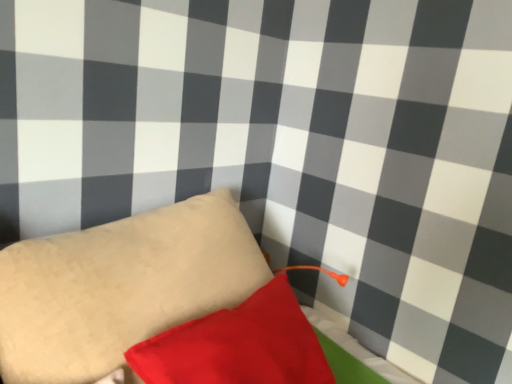
In order to click on beige fabric pillow at center in this screenshot , I will do `click(120, 287)`.

Measure the distance between beige fabric pillow at center and camera.

They are 28.19 inches apart.

The image size is (512, 384). Describe the element at coordinates (120, 287) in the screenshot. I see `beige fabric pillow at center` at that location.

The height and width of the screenshot is (384, 512). What are the coordinates of `beige fabric pillow at center` in the screenshot? It's located at (120, 287).